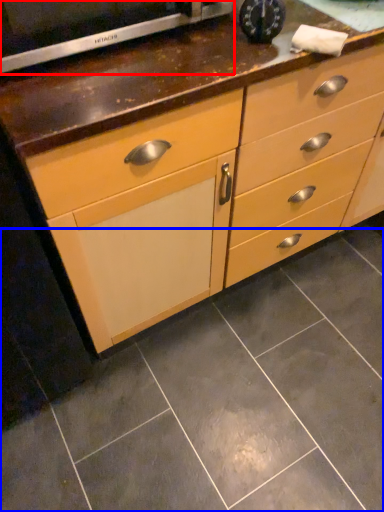
Question: Which point is closer to the camera, appliance (highlighted by a red box) or ceramic tile (highlighted by a blue box)?

Choices:
 (A) appliance
 (B) ceramic tile

Answer: (A)